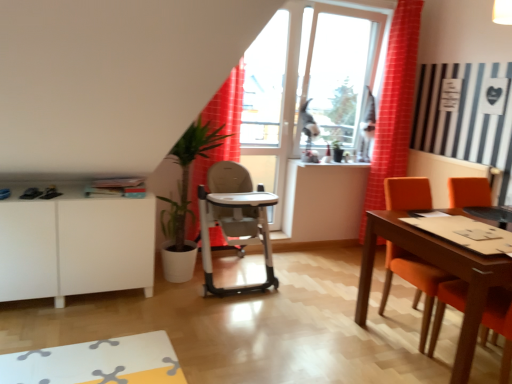
The image size is (512, 384). Identify the location of vacant area that lies in front of white matte cabinet at lower left. (62, 340).